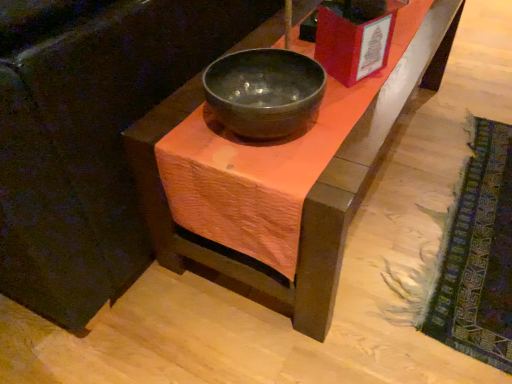
This screenshot has width=512, height=384. In order to click on free point to the left of matte black bowl at center in this screenshot , I will do `click(175, 122)`.